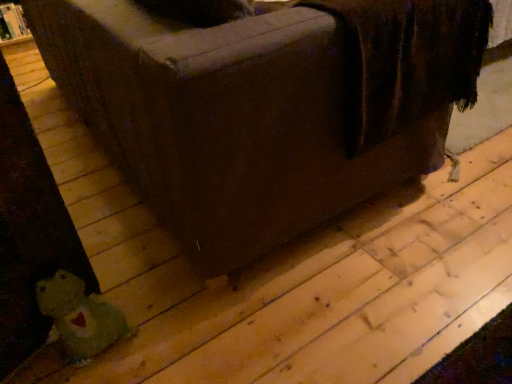
Measure the distance between green plush toy at lower left and camera.

green plush toy at lower left and camera are 38.98 inches apart.

The image size is (512, 384). What do you see at coordinates (80, 316) in the screenshot?
I see `green plush toy at lower left` at bounding box center [80, 316].

The width and height of the screenshot is (512, 384). What are the coordinates of `green plush toy at lower left` in the screenshot? It's located at (80, 316).

You are a GUI agent. You are given a task and a screenshot of the screen. Output one action in this format:
    pyautogui.click(x=<x>, y=<y>)
    Task: Click on the green plush bear at lower left
    This screenshot has height=384, width=512.
    Given the screenshot: What is the action you would take?
    click(x=264, y=108)

Describe the element at coordinates (264, 108) in the screenshot. I see `green plush bear at lower left` at that location.

This screenshot has height=384, width=512. I want to click on green plush toy at lower left, so click(80, 316).

In the image, is green plush toy at lower left on the left side or the right side of green plush bear at lower left?

Clearly, green plush toy at lower left is on the left of green plush bear at lower left in the image.

Between green plush toy at lower left and green plush bear at lower left, which one is positioned behind?

green plush toy at lower left is further away from the camera.

Which is in front, point (123, 320) or point (100, 80)?

Positioned in front is point (123, 320).

From the image's perspective, between green plush toy at lower left and green plush bear at lower left, who is located below?

From the image's view, green plush toy at lower left is below.

Consider the image. From a real-world perspective, is green plush toy at lower left physically located above or below green plush bear at lower left?

green plush toy at lower left is situated lower than green plush bear at lower left in the real world.

Which object is wider, green plush toy at lower left or green plush bear at lower left?

green plush bear at lower left is wider.

Does green plush toy at lower left have a greater height compared to green plush bear at lower left?

In fact, green plush toy at lower left may be shorter than green plush bear at lower left.

Consider the image. Can you confirm if green plush toy at lower left is bigger than green plush bear at lower left?

No.

Is green plush toy at lower left not within green plush bear at lower left?

That's correct, green plush toy at lower left is outside of green plush bear at lower left.

Can you see green plush toy at lower left touching green plush bear at lower left?

No, green plush toy at lower left is not in contact with green plush bear at lower left.

Is green plush toy at lower left positioned with its back to green plush bear at lower left?

No, green plush toy at lower left's orientation is not away from green plush bear at lower left.

You are a GUI agent. You are given a task and a screenshot of the screen. Output one action in this format:
    pyautogui.click(x=<x>, y=<y>)
    Task: Click on the furniture in front of the green plush toy at lower left
    The width and height of the screenshot is (512, 384).
    Given the screenshot: What is the action you would take?
    point(264,108)

Is green plush bear at lower left at the right side of green plush toy at lower left?

Yes.

Which object is further away from the camera, green plush bear at lower left or green plush toy at lower left?

green plush toy at lower left is further away from the camera.

Considering the positions of point (83, 114) and point (98, 345), is point (83, 114) closer or farther from the camera than point (98, 345)?

Point (83, 114) appears to be farther away from the viewer than point (98, 345).

From the image's perspective, is green plush bear at lower left located above or below green plush toy at lower left?

green plush bear at lower left is above green plush toy at lower left.

From a real-world perspective, which object stands above the other?

green plush bear at lower left is physically above.

Which of these two, green plush bear at lower left or green plush toy at lower left, is wider?

green plush bear at lower left.

Is green plush bear at lower left shorter than green plush toy at lower left?

Incorrect, the height of green plush bear at lower left does not fall short of that of green plush toy at lower left.

Which of these two, green plush bear at lower left or green plush toy at lower left, is smaller?

green plush toy at lower left.

Do you think green plush bear at lower left is within green plush toy at lower left, or outside of it?

green plush bear at lower left exists outside the volume of green plush toy at lower left.

Consider the image. Is green plush bear at lower left touching green plush toy at lower left?

No, green plush bear at lower left is not next to green plush toy at lower left.

Is green plush bear at lower left aimed at green plush toy at lower left?

No, green plush bear at lower left is not turned towards green plush toy at lower left.

How many degrees apart are the facing directions of green plush bear at lower left and green plush toy at lower left?

They differ by 67.7 degrees in their facing directions.

Identify the location of furniture above the green plush toy at lower left (from a real-world perspective). (264, 108).

The height and width of the screenshot is (384, 512). I want to click on furniture above the green plush toy at lower left (from a real-world perspective), so click(264, 108).

In the image, there is a green plush bear at lower left. What are the coordinates of `toy below it (from a real-world perspective)` in the screenshot? It's located at (80, 316).